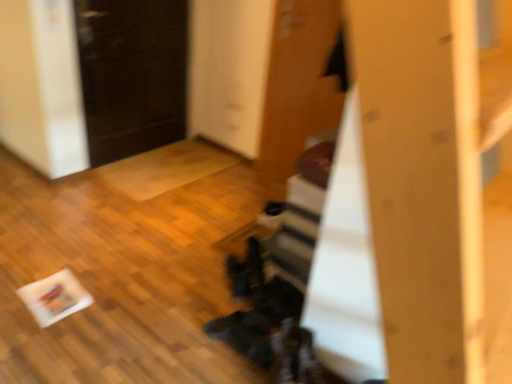
Question: Would you consider black glossy door at upper left, the first door in the left-to-right sequence, to be distant from wooden door at upper center, which is the 2th door from left to right?

Choices:
 (A) no
 (B) yes

Answer: (A)

Question: Does black glossy door at upper left, the 2th door in the right-to-left sequence, have a greater width compared to wooden door at upper center, which is the 1th door in right-to-left order?

Choices:
 (A) no
 (B) yes

Answer: (B)

Question: Considering the relative positions of black glossy door at upper left, the 2th door in the right-to-left sequence, and wooden door at upper center, which is the 2th door from left to right, in the image provided, is black glossy door at upper left, the 2th door in the right-to-left sequence, to the left of wooden door at upper center, which is the 2th door from left to right, from the viewer's perspective?

Choices:
 (A) yes
 (B) no

Answer: (A)

Question: From a real-world perspective, is black glossy door at upper left, the first door in the left-to-right sequence, on wooden door at upper center, which is the 2th door from left to right?

Choices:
 (A) yes
 (B) no

Answer: (B)

Question: Is black glossy door at upper left, the 2th door in the right-to-left sequence, shorter than wooden door at upper center, which is the 2th door from left to right?

Choices:
 (A) no
 (B) yes

Answer: (B)

Question: From a real-world perspective, does black glossy door at upper left, the 2th door in the right-to-left sequence, sit lower than wooden door at upper center, which is the 2th door from left to right?

Choices:
 (A) yes
 (B) no

Answer: (A)

Question: Is wooden door at upper center, which is the 2th door from left to right, behind black glossy door at upper left, the 2th door in the right-to-left sequence?

Choices:
 (A) yes
 (B) no

Answer: (B)

Question: Can you confirm if wooden door at upper center, which is the 1th door in right-to-left order, is positioned to the right of black glossy door at upper left, the 2th door in the right-to-left sequence?

Choices:
 (A) no
 (B) yes

Answer: (B)

Question: Considering the relative sizes of wooden door at upper center, which is the 2th door from left to right, and black glossy door at upper left, the first door in the left-to-right sequence, in the image provided, is wooden door at upper center, which is the 2th door from left to right, smaller than black glossy door at upper left, the first door in the left-to-right sequence,?

Choices:
 (A) no
 (B) yes

Answer: (B)

Question: Does wooden door at upper center, which is the 2th door from left to right, have a greater width compared to black glossy door at upper left, the 2th door in the right-to-left sequence?

Choices:
 (A) no
 (B) yes

Answer: (A)

Question: Can you confirm if wooden door at upper center, which is the 2th door from left to right, is taller than black glossy door at upper left, the first door in the left-to-right sequence?

Choices:
 (A) yes
 (B) no

Answer: (A)

Question: From a real-world perspective, is wooden door at upper center, which is the 1th door in right-to-left order, below black glossy door at upper left, the 2th door in the right-to-left sequence?

Choices:
 (A) no
 (B) yes

Answer: (A)

Question: In the image, is black glossy door at upper left, the first door in the left-to-right sequence, positioned in front of or behind wooden door at upper center, which is the 2th door from left to right?

Choices:
 (A) front
 (B) behind

Answer: (B)